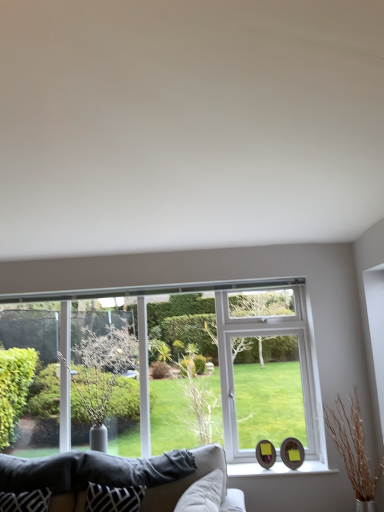
Question: From their relative heights in the image, would you say velvet beige couch at lower center is taller or shorter than blue and white fabric pillow at lower center?

Choices:
 (A) short
 (B) tall

Answer: (B)

Question: From the image's perspective, relative to blue and white fabric pillow at lower center, is velvet beige couch at lower center above or below?

Choices:
 (A) above
 (B) below

Answer: (A)

Question: Considering the real-world distances, which object is closest to the blue and white fabric pillow at lower center?

Choices:
 (A) green leafy tree at left
 (B) white glossy window sill at lower center
 (C) clear glass window at center
 (D) velvet beige couch at lower center

Answer: (D)

Question: Which object is positioned farthest from the blue and white fabric pillow at lower center?

Choices:
 (A) clear glass window at center
 (B) green leafy tree at left
 (C) velvet beige couch at lower center
 (D) white glossy window sill at lower center

Answer: (A)